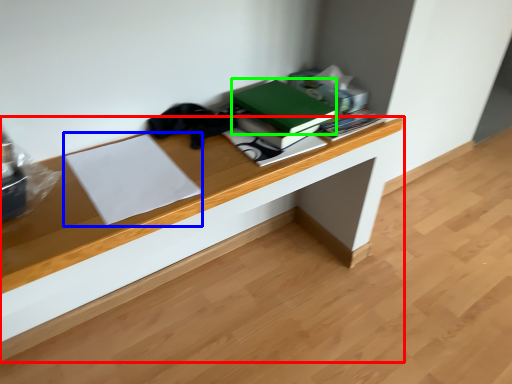
Question: Estimate the real-world distances between objects in this image. Which object is farther from desk (highlighted by a red box), paperback book (highlighted by a blue box) or paperback book (highlighted by a green box)?

Choices:
 (A) paperback book
 (B) paperback book

Answer: (B)